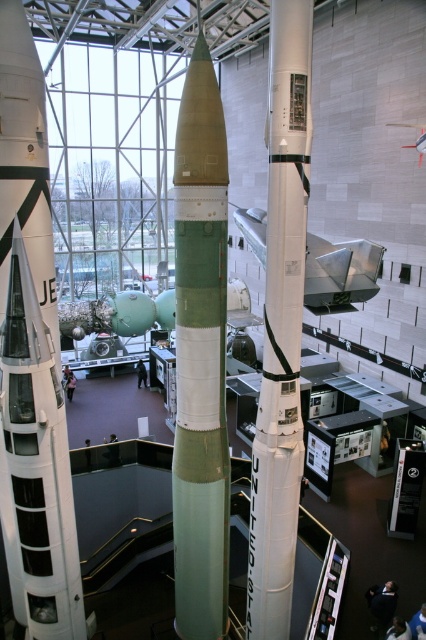
Does point (23, 179) lie behind point (273, 408)?

That is False.

Measure the distance between white matte rocket at left and camera.

white matte rocket at left and camera are 4.74 meters apart from each other.

This screenshot has height=640, width=426. In order to click on white matte rocket at left in this screenshot , I will do `click(31, 358)`.

Is point (19, 257) positioned in front of point (406, 124)?

Yes, point (19, 257) is closer to viewer.

Where is `white matte rocket at left`? This screenshot has height=640, width=426. white matte rocket at left is located at coordinates (31, 358).

You are a GUI agent. You are given a task and a screenshot of the screen. Output one action in this format:
    pyautogui.click(x=<x>, y=<y>)
    Task: Click on the white matte rocket at left
    The width and height of the screenshot is (426, 640).
    Given the screenshot: What is the action you would take?
    pyautogui.click(x=31, y=358)

Which is more to the left, metallic silver airplane at center or metallic silver airplane at upper right?

metallic silver airplane at center

Between metallic silver airplane at center and metallic silver airplane at upper right, which one is positioned lower?

metallic silver airplane at center

Which is in front, point (305, 280) or point (403, 147)?

Point (305, 280) is more forward.

At what (x,y) coordinates should I click in order to perform the action: click on metallic silver airplane at center. Please return your answer as a coordinate pair (x, y). The width and height of the screenshot is (426, 640). Looking at the image, I should click on (339, 273).